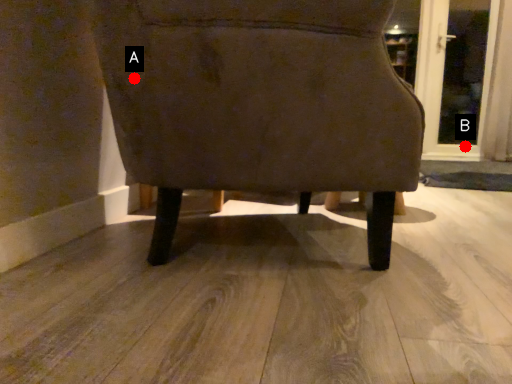
Question: Two points are circled on the image, labeled by A and B beside each circle. Which point is farther from the camera taking this photo?

Choices:
 (A) A is further
 (B) B is further

Answer: (B)